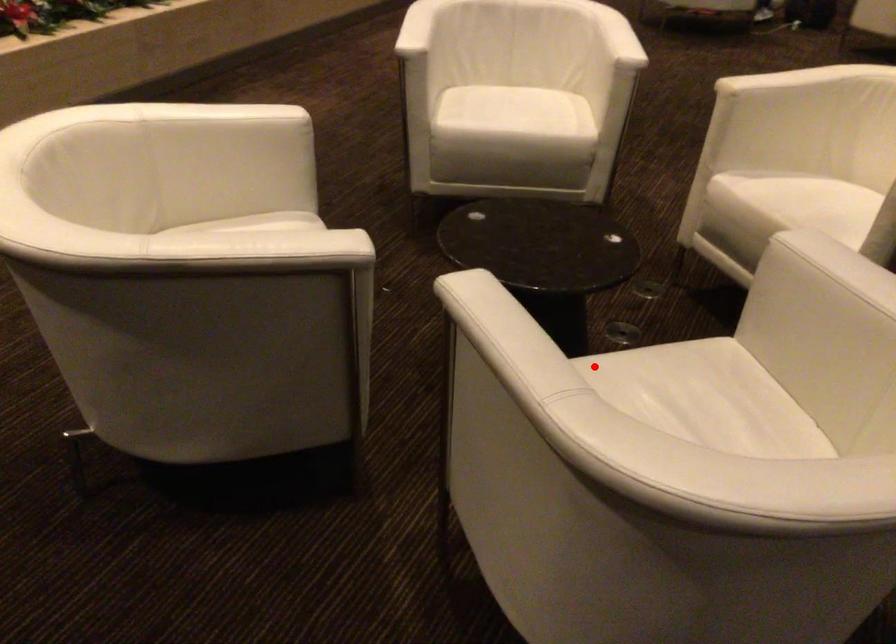
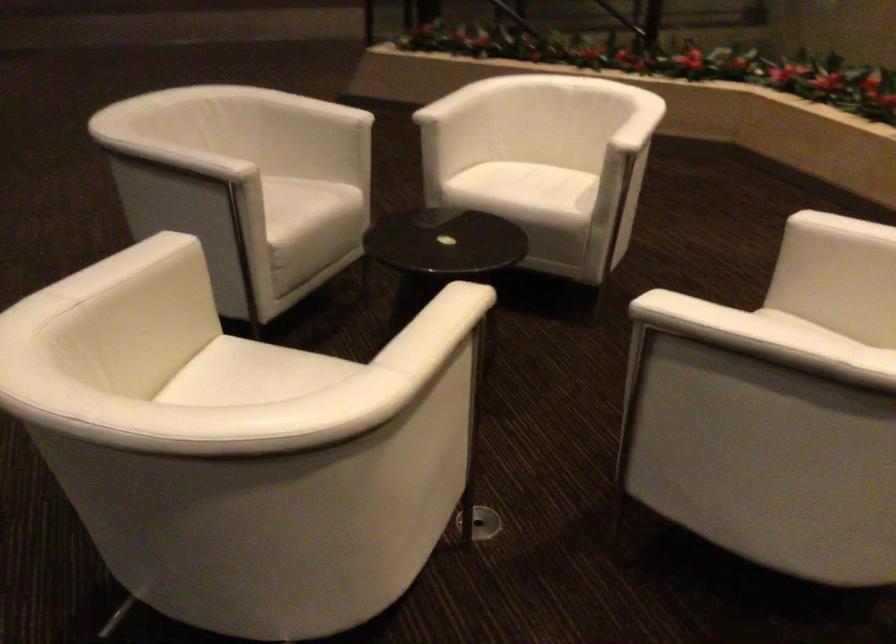
Find the pixel in the second image that matches the highlighted location in the first image.

(306, 205)